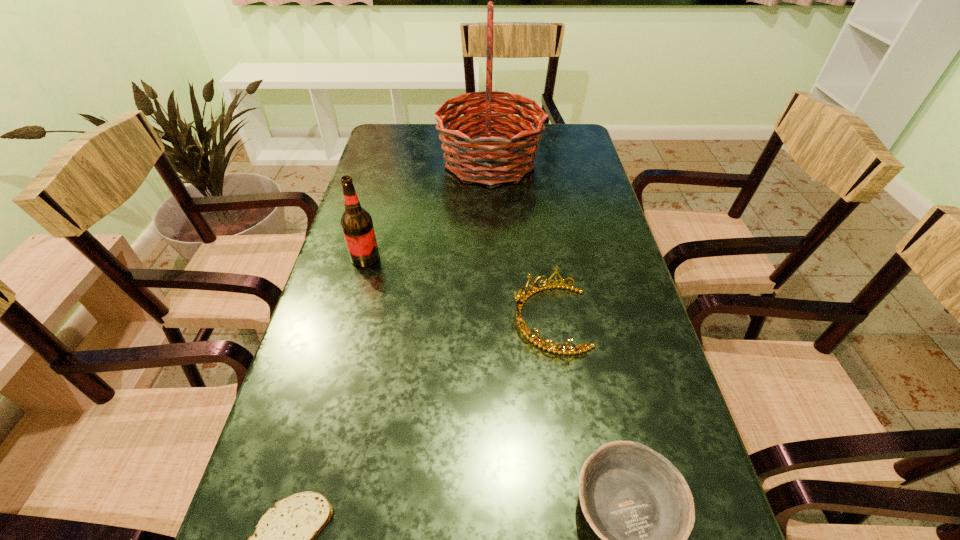
Where is `the farthest object`? the farthest object is located at coordinates (498, 159).

Identify the location of the tallest object. The width and height of the screenshot is (960, 540). (498, 159).

Where is `the second tallest object`? the second tallest object is located at coordinates (356, 223).

I want to click on the fourth nearest object, so click(x=356, y=223).

This screenshot has height=540, width=960. I want to click on tiara, so click(x=519, y=304).

Where is `the third farthest object`? The width and height of the screenshot is (960, 540). the third farthest object is located at coordinates (519, 304).

This screenshot has height=540, width=960. I want to click on free location located on the handle side of the tallest object, so click(388, 162).

Identify the location of free space located 0.170m on the handle side of the tallest object. (385, 162).

I want to click on vacant position located on the handle side of the tallest object, so click(409, 162).

Image resolution: width=960 pixels, height=540 pixels. Find the location of `vacant point located on the back of the second tallest object`. vacant point located on the back of the second tallest object is located at coordinates 372,234.